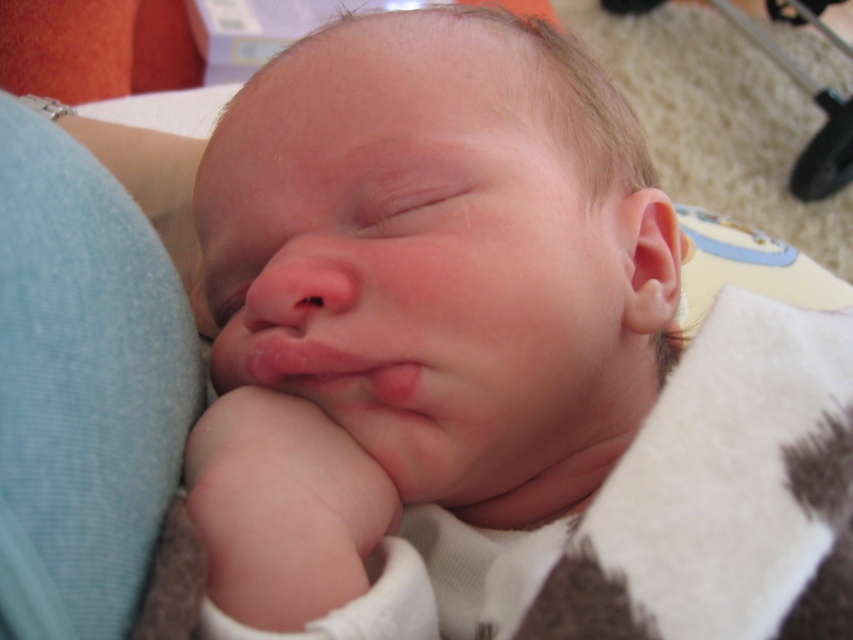
You are a photographer taking a picture of the sleeping baby. You notice two points marked in the image. The first point is at coordinate point (434, 420) and the second point is at coordinate point (831, 104). Which point is closer to the camera?

Point (434, 420) is in front of point (831, 104), so the first point is closer to the camera.

You are a parent preparing to place your smooth skin newborn at center into a metallic silver stroller at upper right. Based on their sizes, will the newborn fit comfortably into the stroller?

The smooth skin newborn at center has a width less than the metallic silver stroller at upper right, so the newborn will fit comfortably into the stroller.